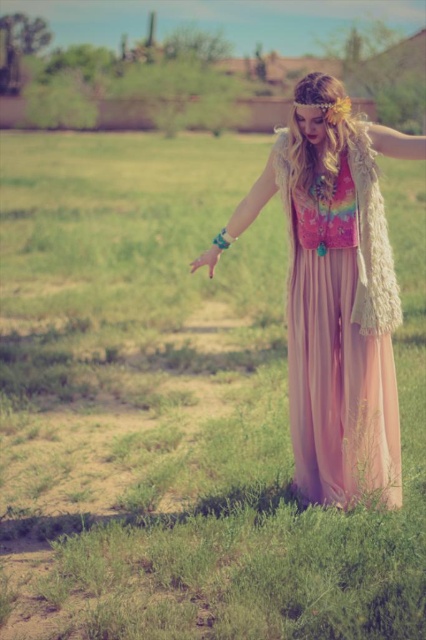
Question: Which of the following is the closest to the observer?

Choices:
 (A) (282, 145)
 (B) (380, 202)

Answer: (B)

Question: Which point is farther to the camera?

Choices:
 (A) (328, 234)
 (B) (305, 493)

Answer: (B)

Question: Is pastel chiffon dress at center below pink chiffon dress at center?

Choices:
 (A) no
 (B) yes

Answer: (A)

Question: Is pastel chiffon dress at center wider than pink chiffon dress at center?

Choices:
 (A) no
 (B) yes

Answer: (B)

Question: Which object is farther from the camera taking this photo?

Choices:
 (A) pastel chiffon dress at center
 (B) pink chiffon dress at center

Answer: (B)

Question: From the image, what is the correct spatial relationship of pastel chiffon dress at center in relation to pink chiffon dress at center?

Choices:
 (A) right
 (B) left

Answer: (B)